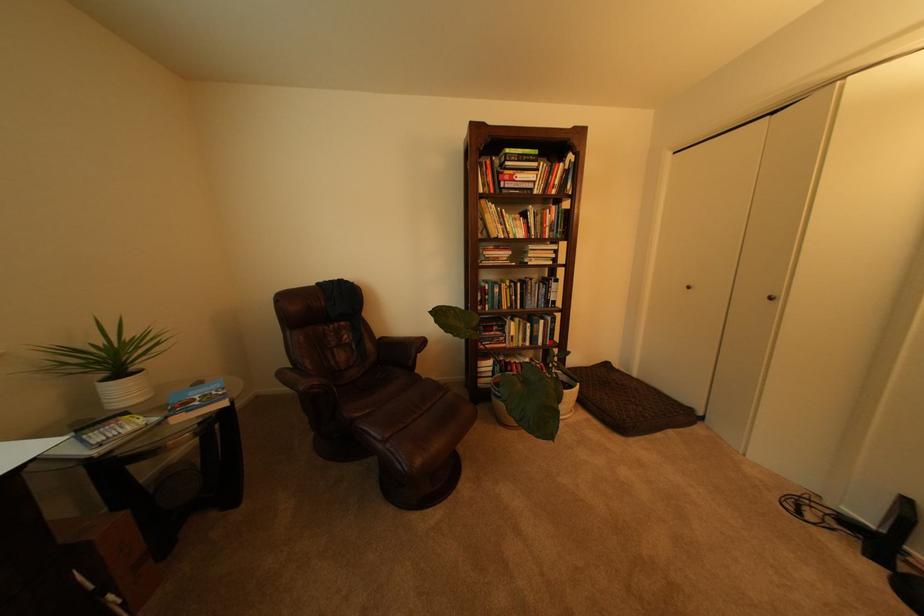
The width and height of the screenshot is (924, 616). What are the coordinates of `white plant pot` in the screenshot? It's located at (126, 363).